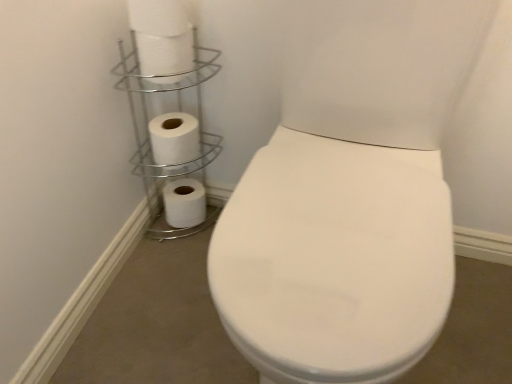
Question: Is white matte toilet paper at upper left, placed as the second toilet paper when sorted from top to bottom, wider or thinner than silver/metallic toilet paper holder at upper left?

Choices:
 (A) wide
 (B) thin

Answer: (B)

Question: In terms of size, does white matte toilet paper at upper left, placed as the second toilet paper when sorted from top to bottom, appear bigger or smaller than silver/metallic toilet paper holder at upper left?

Choices:
 (A) big
 (B) small

Answer: (B)

Question: Based on their relative distances, which object is farther from the white matte toilet paper at upper left, which ranks as the first toilet paper in front-to-back order?

Choices:
 (A) white matte toilet paper at upper left, marked as the 3th toilet paper in a bottom-to-top arrangement
 (B) white matte toilet paper at upper left, the 2th toilet paper in the back-to-front sequence
 (C) silver/metallic toilet paper holder at upper left
 (D) white matte toilet paper at lower left, placed as the first toilet paper when sorted from back to front

Answer: (D)

Question: Which object is positioned closest to the white matte toilet paper at upper left, which ranks as the first toilet paper in front-to-back order?

Choices:
 (A) silver/metallic toilet paper holder at upper left
 (B) white matte toilet paper at lower left, which is the 1th toilet paper in bottom-to-top order
 (C) white matte toilet paper at upper left, the 2th toilet paper from the bottom
 (D) white matte toilet paper at upper left, the 2th toilet paper from the front

Answer: (D)